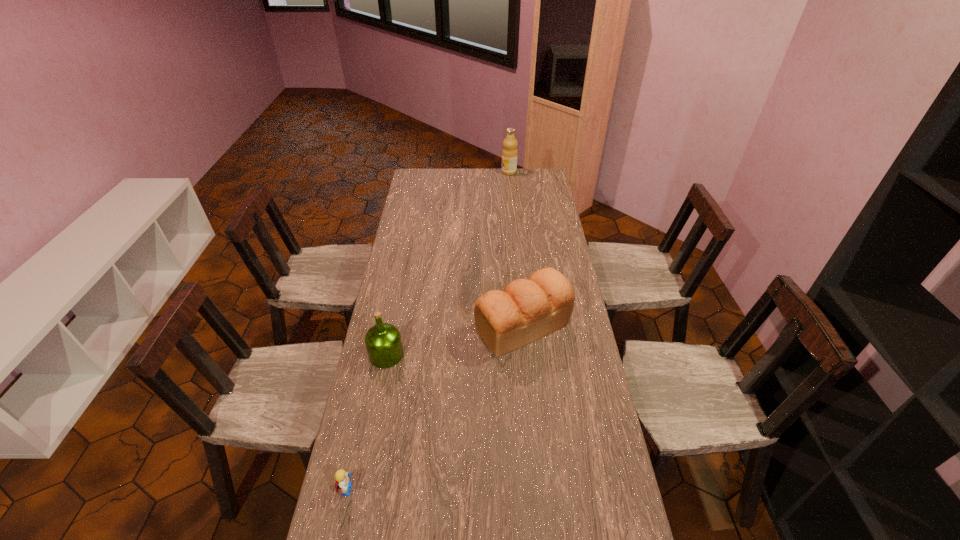
Where is `the farther olive oil`? the farther olive oil is located at coordinates (509, 153).

Identify the location of the tallest object. The image size is (960, 540). (509, 153).

Find the location of a particular element. The image size is (960, 540). bread is located at coordinates (527, 310).

Find the location of a particular element. This screenshot has height=540, width=960. the nearer olive oil is located at coordinates (383, 342).

Image resolution: width=960 pixels, height=540 pixels. I want to click on the left olive oil, so click(383, 342).

In order to click on the shortest object in this screenshot , I will do coord(342,482).

Find the location of a particular element. Lego is located at coordinates (342, 482).

The width and height of the screenshot is (960, 540). I want to click on free spot located 0.270m on the label of the tallest object, so click(454, 172).

Find the location of a particular element. The width and height of the screenshot is (960, 540). free spot located on the label of the tallest object is located at coordinates (463, 172).

I want to click on free space located on the label of the tallest object, so click(x=467, y=172).